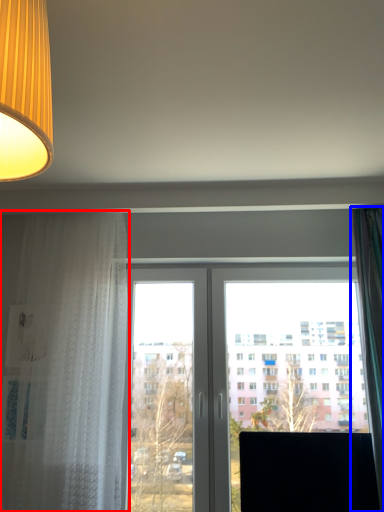
Question: Among these objects, which one is nearest to the camera, curtain (highlighted by a red box) or curtain (highlighted by a blue box)?

Choices:
 (A) curtain
 (B) curtain

Answer: (B)